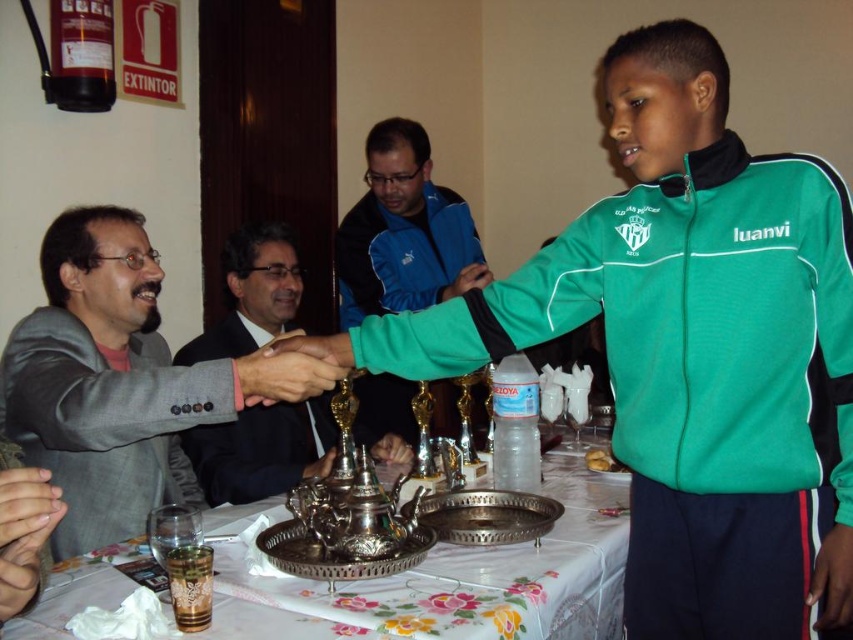
Question: In this image, where is silver metallic tray at center located relative to metallic silver teapot at center?

Choices:
 (A) right
 (B) left

Answer: (A)

Question: Which of the following is the farthest from the observer?

Choices:
 (A) pyautogui.click(x=260, y=364)
 (B) pyautogui.click(x=561, y=262)
 (C) pyautogui.click(x=457, y=636)
 (D) pyautogui.click(x=76, y=355)

Answer: (D)

Question: Which object is farther from the camera taking this photo?

Choices:
 (A) golden crispy pastry at right
 (B) metallic gold trophy at center
 (C) metallic silver teapot at center

Answer: (C)

Question: Among these points, which one is nearest to the camera?

Choices:
 (A) (660, 508)
 (B) (286, 244)
 (C) (393, 128)
 (D) (236, 577)

Answer: (D)

Question: Does green track suit at center appear on the right side of shiny black suit at center?

Choices:
 (A) no
 (B) yes

Answer: (B)

Question: Observing the image, what is the correct spatial positioning of gray suit at left in reference to metallic silver teapot at center?

Choices:
 (A) below
 (B) above

Answer: (B)